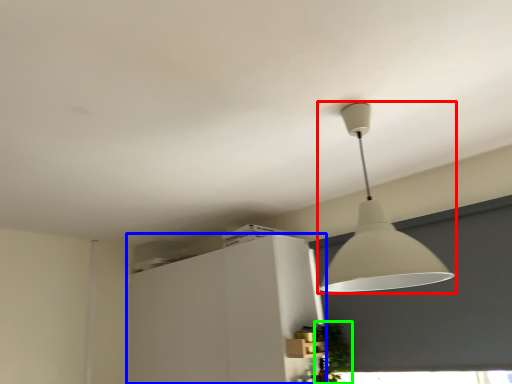
Question: Based on their relative distances, which object is farther from lamp (highlighted by a red box)? Choose from cabinetry (highlighted by a blue box) and plant (highlighted by a green box).

Choices:
 (A) cabinetry
 (B) plant

Answer: (A)